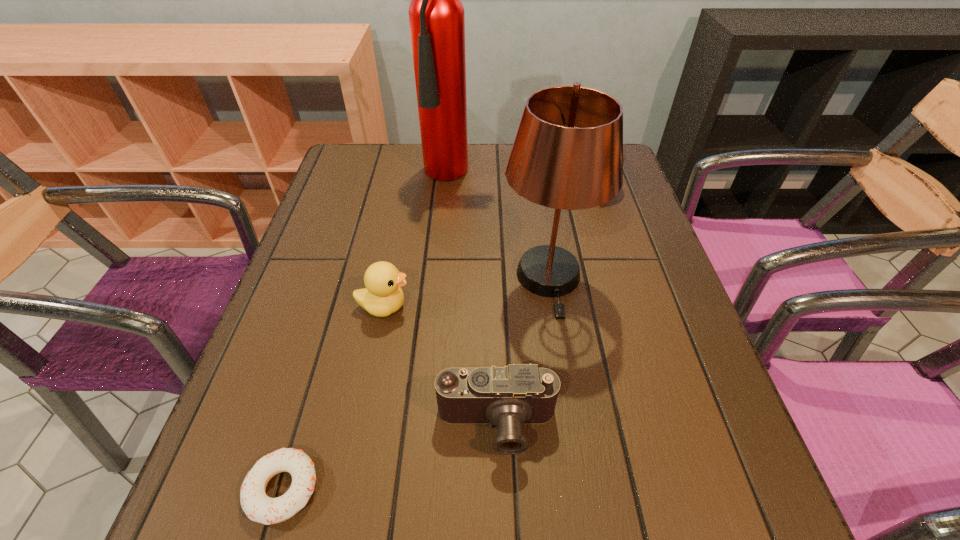
Where is `empty location between the duck and the tallest object`? This screenshot has width=960, height=540. empty location between the duck and the tallest object is located at coordinates (422, 240).

At what (x,y) coordinates should I click in order to perform the action: click on vacant space that is in between the camera and the duck. Please return your answer as a coordinate pair (x, y). Looking at the image, I should click on (441, 366).

Locate an element on the screen. The image size is (960, 540). empty space between the camera and the fire extinguisher is located at coordinates (478, 300).

You are a GUI agent. You are given a task and a screenshot of the screen. Output one action in this format:
    pyautogui.click(x=<x>, y=<y>)
    Task: Click on the vacant space in between the lampshade and the duck
    The height and width of the screenshot is (540, 960).
    Given the screenshot: What is the action you would take?
    pyautogui.click(x=467, y=292)

Identify the location of vacant space that's between the bowl and the camera. The width and height of the screenshot is (960, 540). (548, 305).

Find the location of a particular element. This screenshot has width=960, height=540. free point between the duck and the fire extinguisher is located at coordinates (422, 240).

This screenshot has width=960, height=540. I want to click on free area in between the duck and the rightmost object, so click(x=492, y=246).

Select which object is the third closest to the fifth shortest object. Please provide its 2D coordinates. Your answer should be formatted as a tuple, i.e. [(x, y)], where the tuple contains the x and y coordinates of a point satisfying the conditions above.

[(383, 295)]

Identify which object is the fourth closest to the duck. Please provide its 2D coordinates. Your answer should be formatted as a tuple, i.e. [(x, y)], where the tuple contains the x and y coordinates of a point satisfying the conditions above.

[(436, 14)]

The height and width of the screenshot is (540, 960). In order to click on free region that satisfies the following two spatial constraints: 1. on the front-facing side of the fifth shortest object; 2. on the face of the duck in this screenshot , I will do `click(553, 306)`.